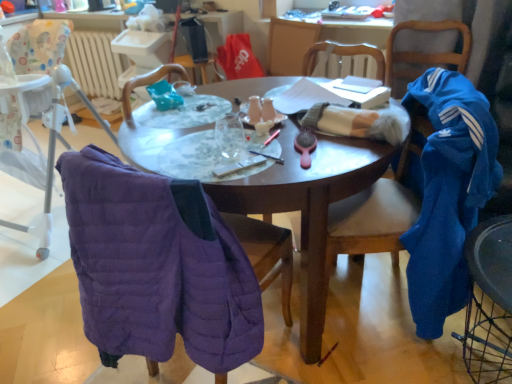
Find the location of a particular element. spots to the right of matte black pen at center is located at coordinates (320, 152).